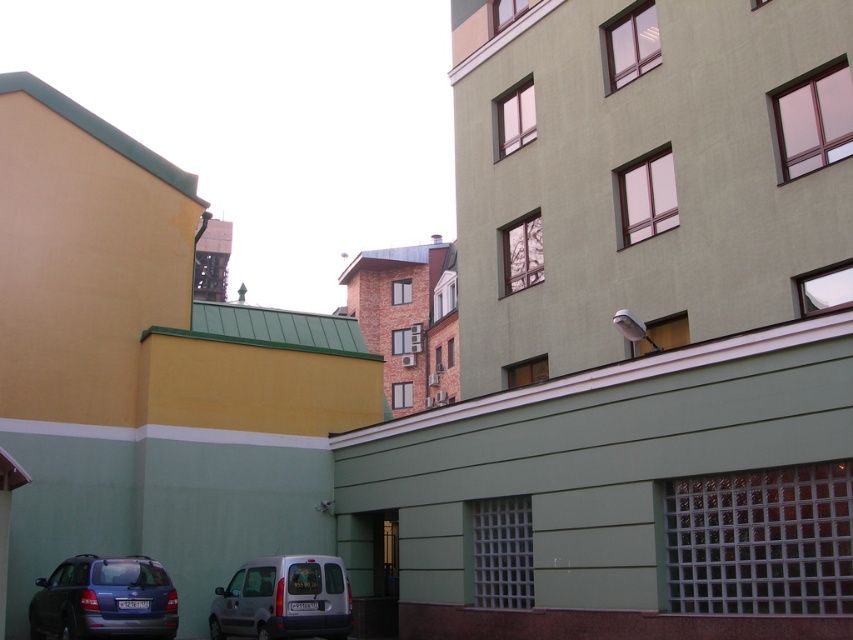
You are a delivery driver who needs to park your vehicle in a tight space near the buildings. You have a matte blue station wagon at lower left and a silver metallic van at lower left. Which vehicle would be easier to maneuver into the space?

The matte blue station wagon at lower left occupies less space than the silver metallic van at lower left, so it would be easier to maneuver into the tight space.

You are driving a car and see the matte blue station wagon at lower left and the silver metallic van at lower left in the parking lot. Which vehicle is positioned more to the left side of the parking lot?

The matte blue station wagon at lower left is positioned more to the left side of the parking lot because it is to the left of the silver metallic van at lower left.